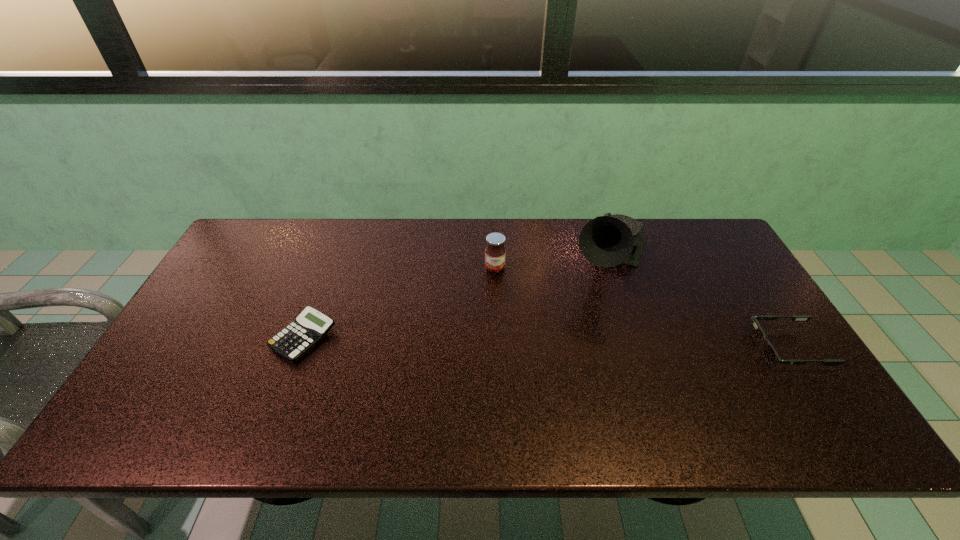
The image size is (960, 540). In order to click on the leftmost object in this screenshot , I will do `click(310, 326)`.

Find the location of a particular element. the shortest object is located at coordinates (310, 326).

This screenshot has height=540, width=960. I want to click on sunglasses, so click(770, 355).

The width and height of the screenshot is (960, 540). What are the coordinates of `the third tallest object` in the screenshot? It's located at (770, 355).

The width and height of the screenshot is (960, 540). Find the location of `the second object from left to right`. the second object from left to right is located at coordinates [495, 252].

The width and height of the screenshot is (960, 540). I want to click on the second tallest object, so click(495, 252).

You are a GUI agent. You are given a task and a screenshot of the screen. Output one action in this format:
    pyautogui.click(x=<x>, y=<y>)
    Task: Click on the second object from right to left
    
    Given the screenshot: What is the action you would take?
    pyautogui.click(x=606, y=241)

Identify the location of the tallest object. This screenshot has width=960, height=540. (606, 241).

This screenshot has height=540, width=960. What are the coordinates of `free spot located on the left of the leftmost object` in the screenshot? It's located at (220, 338).

At what (x,y) coordinates should I click in order to perform the action: click on vacant space located 0.130m on the temples of the sunglasses. Please return your answer as a coordinate pair (x, y). The height and width of the screenshot is (540, 960). Looking at the image, I should click on pos(706,348).